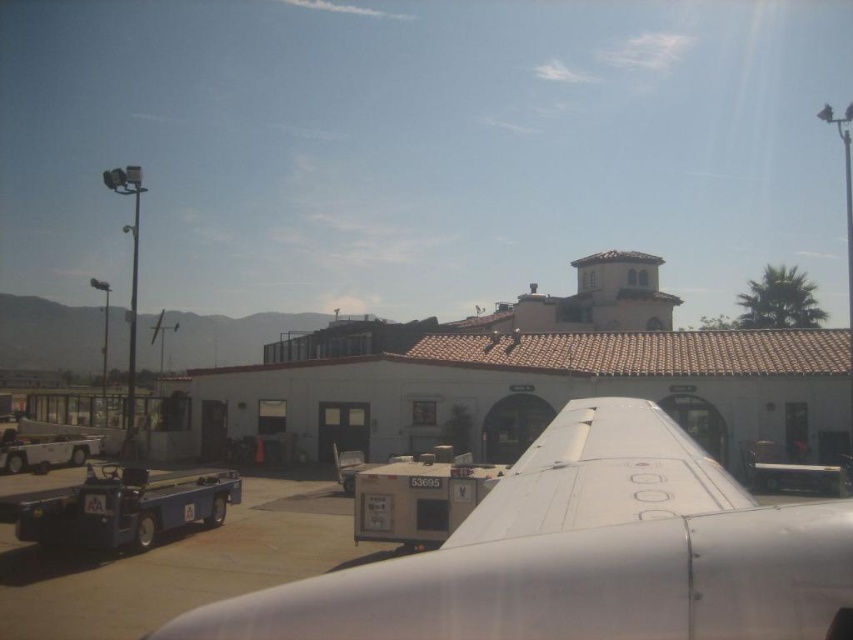
Can you confirm if white matte airplane wing at center is smaller than smooth gray tarmac at lower left?

No.

Between white matte airplane wing at center and smooth gray tarmac at lower left, which one has less height?

Standing shorter between the two is smooth gray tarmac at lower left.

What do you see at coordinates (583, 554) in the screenshot?
I see `white matte airplane wing at center` at bounding box center [583, 554].

What are the coordinates of `white matte airplane wing at center` in the screenshot? It's located at (x=583, y=554).